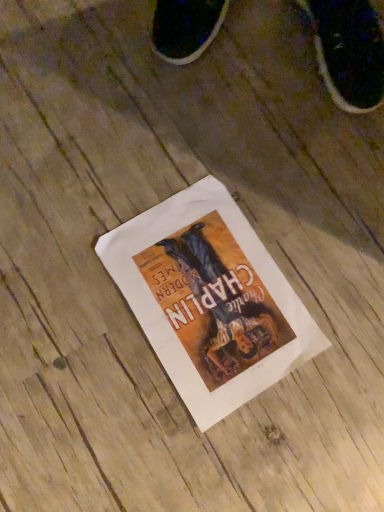
Find the location of a particular element. This screenshot has height=512, width=384. free space above white paper at center (from a real-world perspective) is located at coordinates (208, 295).